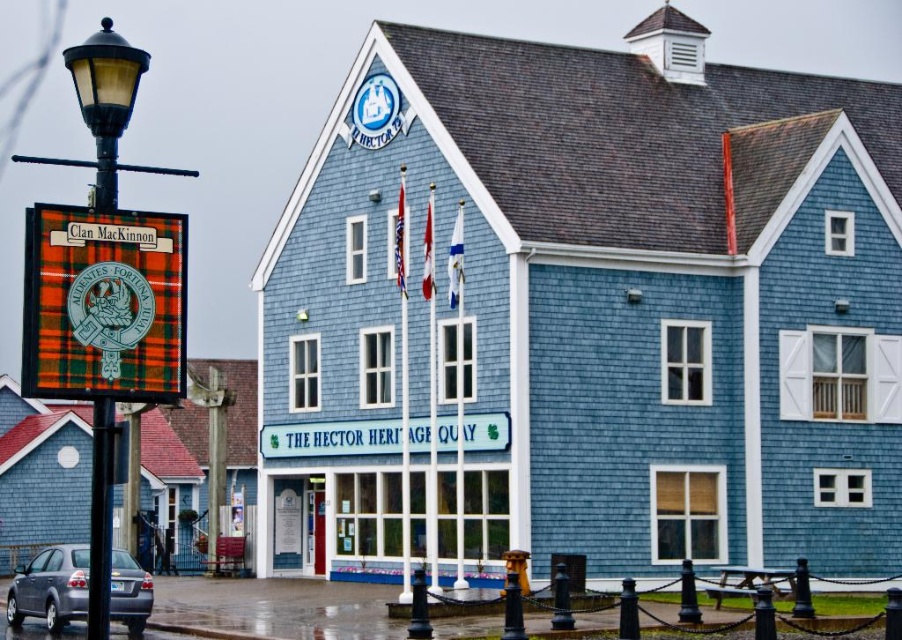
You are a tour guide standing in front of the building and want to point out both the plaid fabric clan mackinnon sign at left and the plaid fabric sign at center to your group. If you can only point in one direction, which direction should you face to ensure both signs are visible in your field of view?

You should face towards the building because both the plaid fabric clan mackinnon sign at left and the plaid fabric sign at center are located in front of the building, which is 27.42 meters apart. Facing the building allows you to see both signs within your field of view.

You are a delivery person who needs to park your 1.5 meter tall delivery cart in front of the building. The parking area is between the metallic gray sedan at lower left and the plaid fabric sign at left. Can your cart fit vertically between them without touching either?

The metallic gray sedan at lower left is taller than the plaid fabric sign at left. Since the delivery cart is 1.5 meters tall, it can fit vertically between them as long as the shortest distance between them is at least 1.5 meters. However, the height difference between the two objects isn

You are a visitor standing in front of the building. You notice the matte black lamp post at left and the plaid fabric sign at left. Which object is taller?

The matte black lamp post at left is taller than the plaid fabric sign at left.